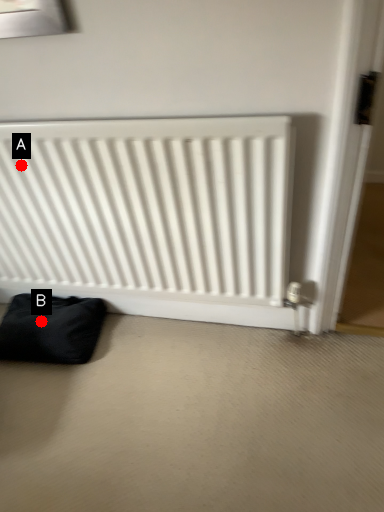
Question: Two points are circled on the image, labeled by A and B beside each circle. Which point is closer to the camera taking this photo?

Choices:
 (A) A is closer
 (B) B is closer

Answer: (A)